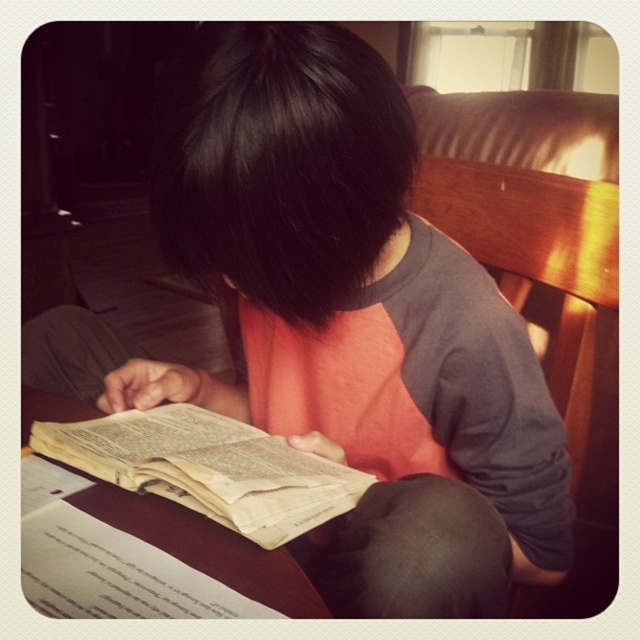
Question: Among these objects, which one is nearest to the camera?

Choices:
 (A) black fabric at lower center
 (B) yellowish paper book at center

Answer: (B)

Question: Which point is closer to the camera?

Choices:
 (A) wooden chair at right
 (B) yellowish paper book at center

Answer: (B)

Question: Does yellowish paper book at center have a greater width compared to black fabric at lower center?

Choices:
 (A) yes
 (B) no

Answer: (A)

Question: Does yellowish paper book at center appear on the left side of black fabric at lower center?

Choices:
 (A) no
 (B) yes

Answer: (B)

Question: Which point appears farthest from the camera in this image?

Choices:
 (A) (525, 192)
 (B) (252, 480)
 (C) (387, 490)

Answer: (A)

Question: Is the position of yellowish paper book at center more distant than that of black fabric at lower center?

Choices:
 (A) no
 (B) yes

Answer: (A)